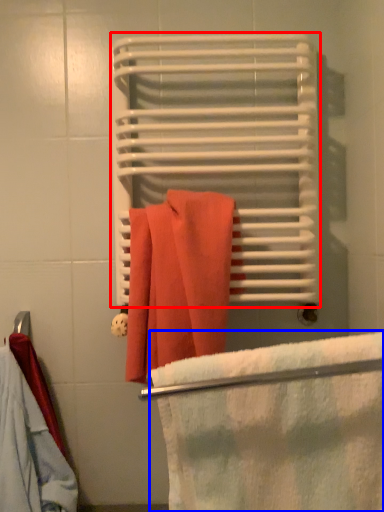
Question: Which object is closer to the camera taking this photo, bath towel (highlighted by a red box) or beach towel (highlighted by a blue box)?

Choices:
 (A) bath towel
 (B) beach towel

Answer: (B)